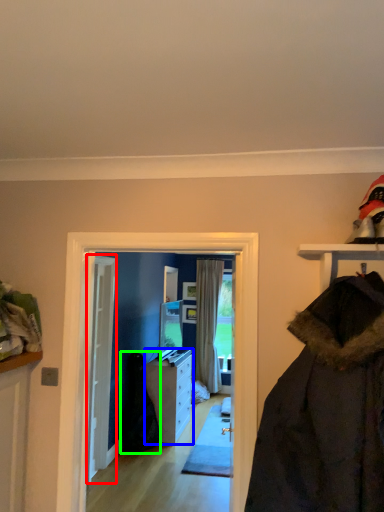
Question: Which is nearer to the door (highlighted by a red box)? cabinetry (highlighted by a blue box) or garment (highlighted by a green box).

Choices:
 (A) cabinetry
 (B) garment

Answer: (B)